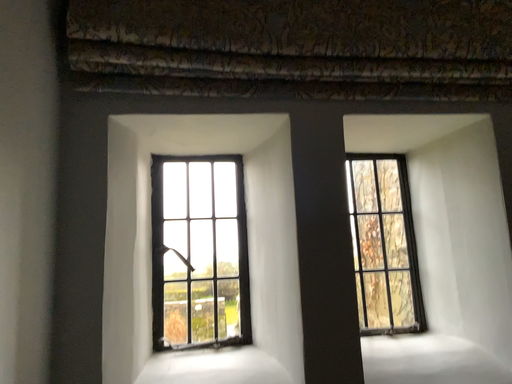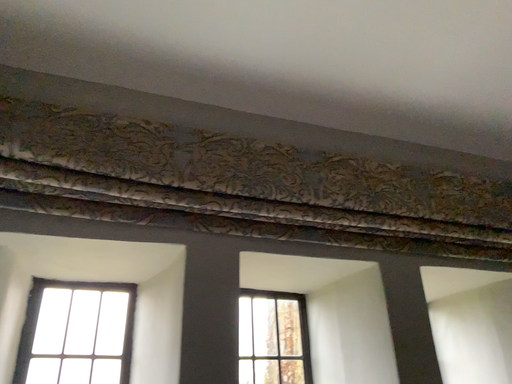
Question: Which way did the camera rotate in the video?

Choices:
 (A) rotated upward
 (B) rotated downward

Answer: (A)